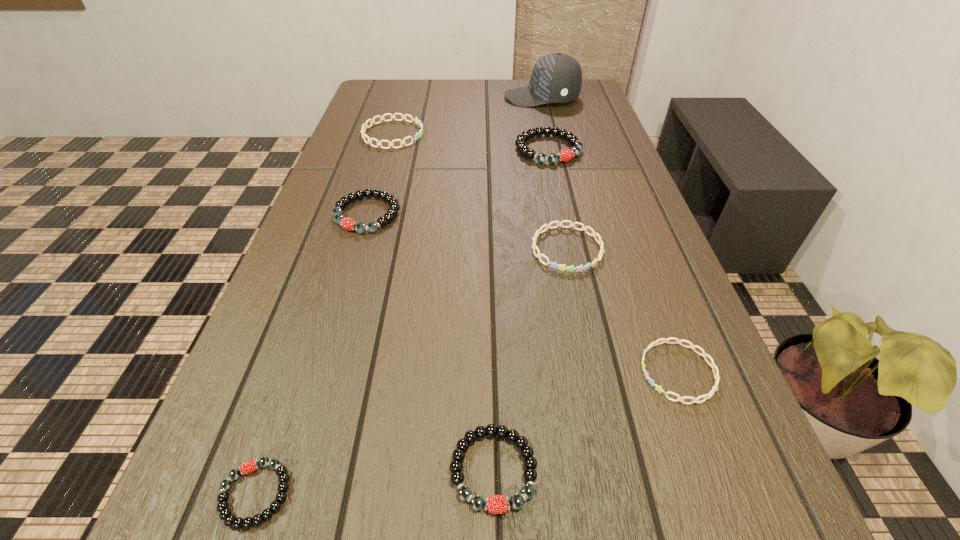
Identify which bracelet is the fifth closest to the biggest blue bracelet. Please provide its 2D coordinates. Your answer should be formatted as a tuple, i.e. [(x, y)], where the tuple contains the x and y coordinates of a point satisfying the conditions above.

[(497, 504)]

Identify which bracelet is the third closest to the third nearest object. Please provide its 2D coordinates. Your answer should be formatted as a tuple, i.e. [(x, y)], where the tuple contains the x and y coordinates of a point satisfying the conditions above.

[(225, 514)]

Identify which black bracelet is the closest to the rightmost blue bracelet. Please provide its 2D coordinates. Your answer should be formatted as a tuple, i.e. [(x, y)], where the tuple contains the x and y coordinates of a point satisfying the conditions above.

[(497, 504)]

Find the location of `black bracelet that is the closest to the rightmost black bracelet`. black bracelet that is the closest to the rightmost black bracelet is located at coordinates (347, 223).

What are the coordinates of `blue bracelet object that ranks as the second closest to the nearest blue bracelet` in the screenshot? It's located at (x=364, y=126).

Find the location of `blue bracelet that is the third closest to the farthest black bracelet`. blue bracelet that is the third closest to the farthest black bracelet is located at coordinates pos(716,375).

The width and height of the screenshot is (960, 540). In order to click on blank area in the image that satisfies the following two spatial constraints: 1. on the surface of the leftmost blue bracelet showing star-shaped elements; 2. on the back side of the third biggest black bracelet in this screenshot , I will do `click(295, 469)`.

Identify the location of free space that satisfies the following two spatial constraints: 1. on the surface of the farthest blue bracelet showing star-shaped elements; 2. on the front side of the third smallest black bracelet. (370, 214).